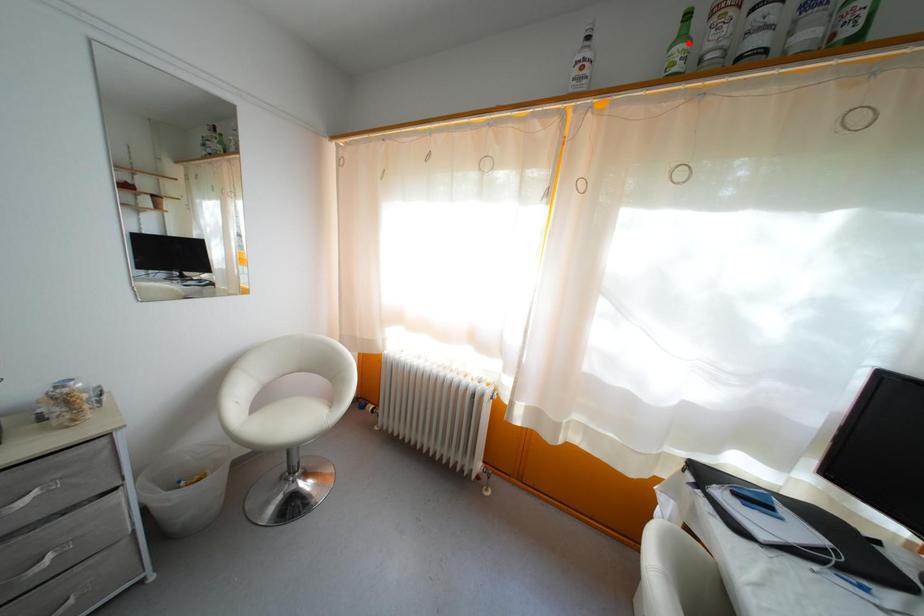
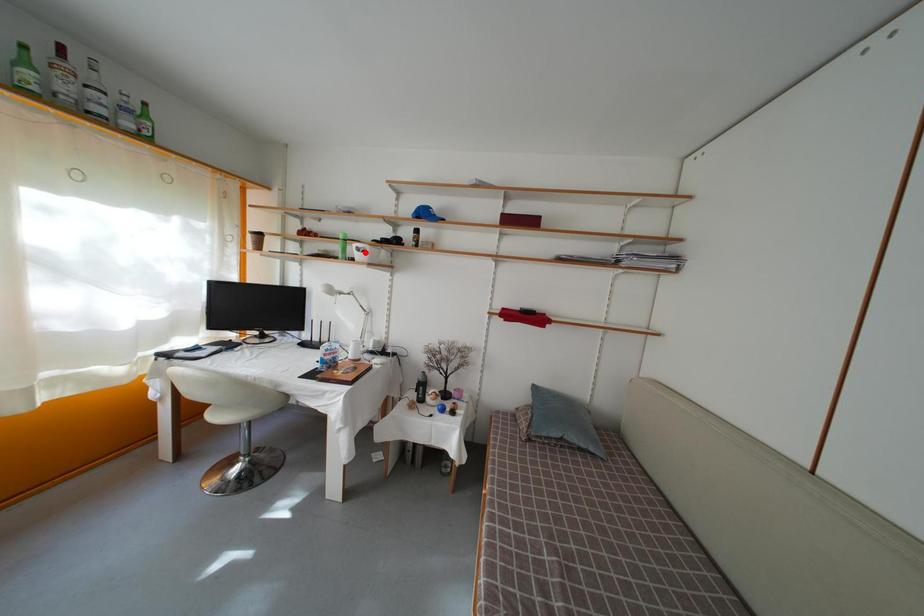
I am providing you with two images of the same scene from different viewpoints. A red point is marked on the first image and another point is marked on the second image. Do the highlighted points in image1 and image2 indicate the same real-world spot?

No